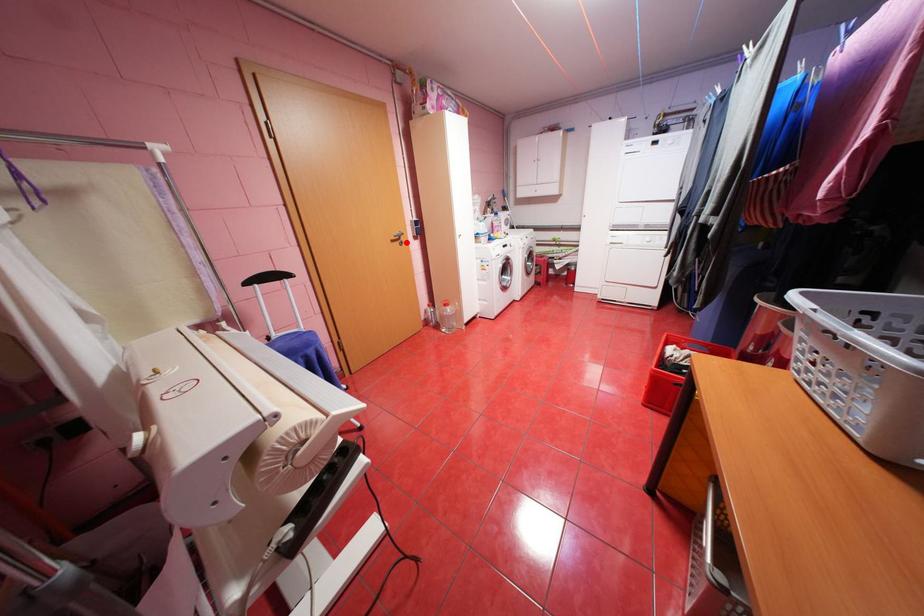
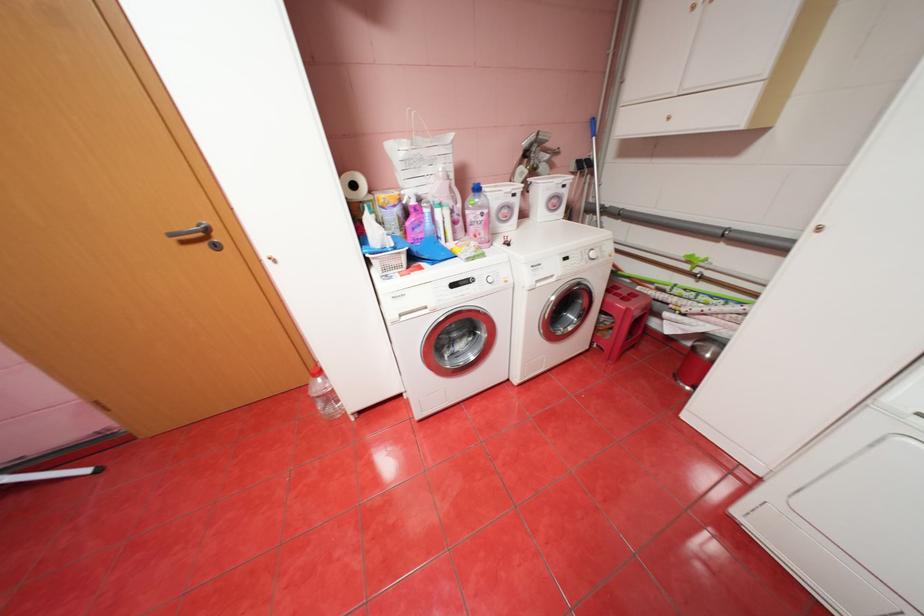
In the second image, find the point that corresponds to the highlighted location in the first image.

(213, 245)